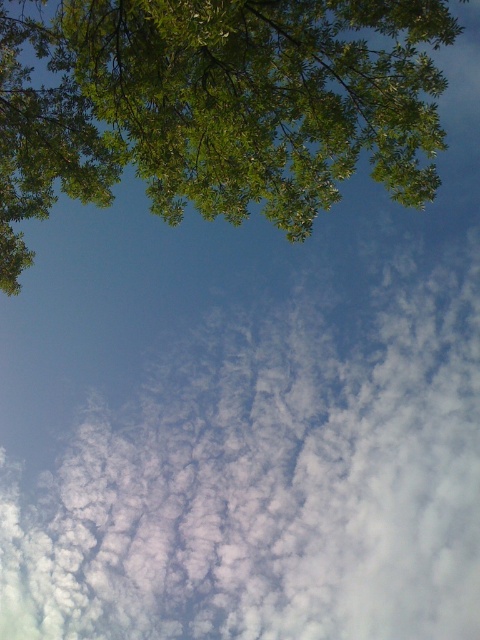
Question: In this image, where is white fluffy cloud at upper center located relative to green leafy tree at upper left?

Choices:
 (A) left
 (B) right

Answer: (B)

Question: Which point is closer to the camera?

Choices:
 (A) white fluffy cloud at upper center
 (B) green leafy tree at upper left

Answer: (B)

Question: Can you confirm if white fluffy cloud at upper center is thinner than green leafy tree at upper left?

Choices:
 (A) yes
 (B) no

Answer: (B)

Question: Is white fluffy cloud at upper center to the left of green leafy tree at upper left from the viewer's perspective?

Choices:
 (A) yes
 (B) no

Answer: (B)

Question: Which point is farther from the camera taking this photo?

Choices:
 (A) (309, 214)
 (B) (63, 609)

Answer: (B)